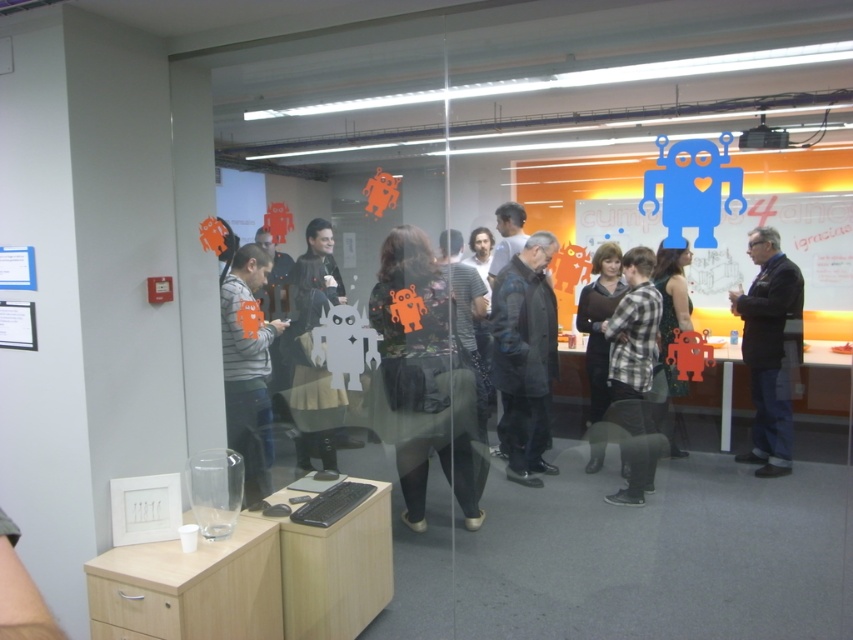
Between blue paper robot at upper right and dark gray textured coat at center, which one appears on the right side from the viewer's perspective?

blue paper robot at upper right is more to the right.

Based on the photo, is blue paper robot at upper right shorter than dark gray textured coat at center?

Yes, blue paper robot at upper right is shorter than dark gray textured coat at center.

Does point (706, 269) come in front of point (527, 292)?

No, it is behind (527, 292).

Locate an element on the screen. The width and height of the screenshot is (853, 640). blue paper robot at upper right is located at coordinates (788, 256).

Between floral-patterned sweater at center and dark gray jacket at center, which one is positioned higher?

dark gray jacket at center is above.

Can you confirm if floral-patterned sweater at center is smaller than dark gray jacket at center?

Actually, floral-patterned sweater at center might be larger than dark gray jacket at center.

Which is in front, point (412, 436) or point (299, 394)?

Positioned in front is point (412, 436).

In order to click on floral-patterned sweater at center in this screenshot , I will do `click(422, 378)`.

Is gray sweater at center to the left of black fabric jacket at center from the viewer's perspective?

Correct, you'll find gray sweater at center to the left of black fabric jacket at center.

Describe the element at coordinates (248, 371) in the screenshot. I see `gray sweater at center` at that location.

Who is more distant from viewer, (247, 349) or (608, 296)?

The point (608, 296) is behind.

This screenshot has width=853, height=640. I want to click on gray sweater at center, so click(248, 371).